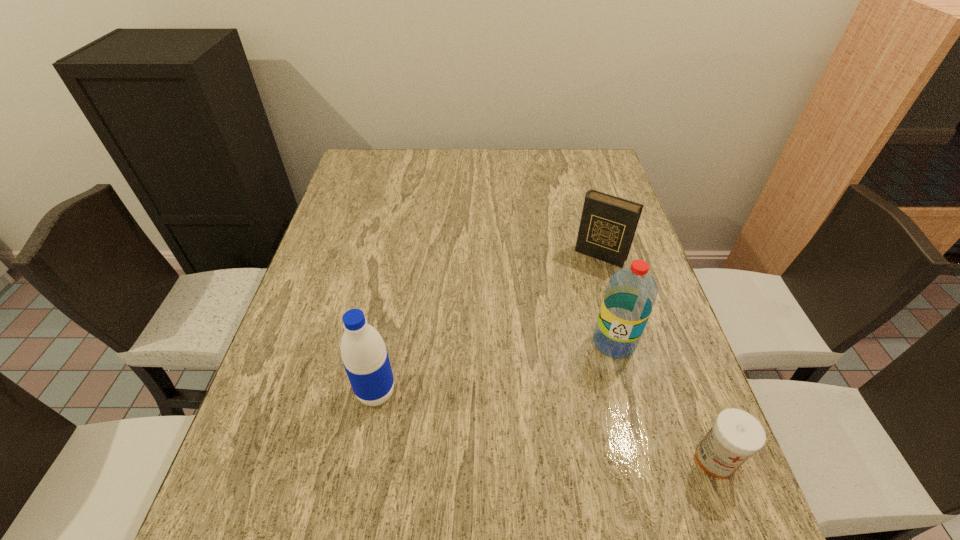
Image resolution: width=960 pixels, height=540 pixels. In order to click on object at the near right corner in this screenshot , I will do `click(736, 435)`.

Locate an element on the screen. The width and height of the screenshot is (960, 540). vacant space at the far edge of the desktop is located at coordinates (478, 166).

In the image, there is a desktop. Where is `free space at the near edge`? free space at the near edge is located at coordinates (495, 483).

Image resolution: width=960 pixels, height=540 pixels. What are the coordinates of `vacant space at the left edge of the desktop` in the screenshot? It's located at (300, 360).

Find the location of a particular element. Image resolution: width=960 pixels, height=540 pixels. vacant area at the right edge is located at coordinates click(631, 378).

At what (x,y) coordinates should I click in order to perform the action: click on blank area at the near left corner. Please return your answer as a coordinate pair (x, y). Looking at the image, I should click on (276, 452).

In the image, there is a desktop. Where is `free space at the far right corner`? This screenshot has width=960, height=540. free space at the far right corner is located at coordinates (580, 150).

You are a GUI agent. You are given a task and a screenshot of the screen. Output one action in this format:
    pyautogui.click(x=<x>, y=<y>)
    Task: Click on the free space between the shortest object and the third tallest object
    
    Given the screenshot: What is the action you would take?
    pyautogui.click(x=658, y=357)

The width and height of the screenshot is (960, 540). Identify the location of free space between the right water bottle and the nearest object. (664, 401).

The height and width of the screenshot is (540, 960). Find the location of `free point between the farthest object and the medicine`. free point between the farthest object and the medicine is located at coordinates (658, 357).